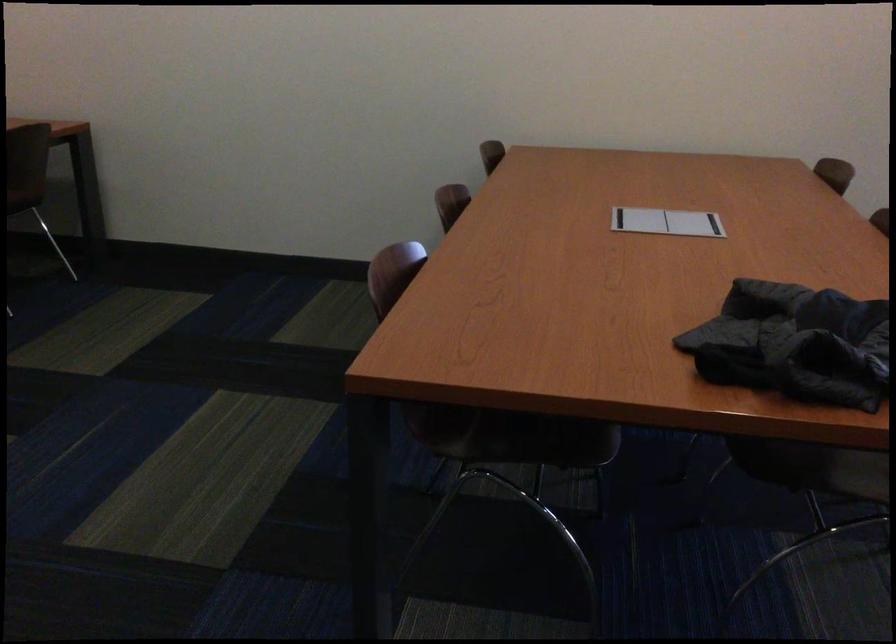
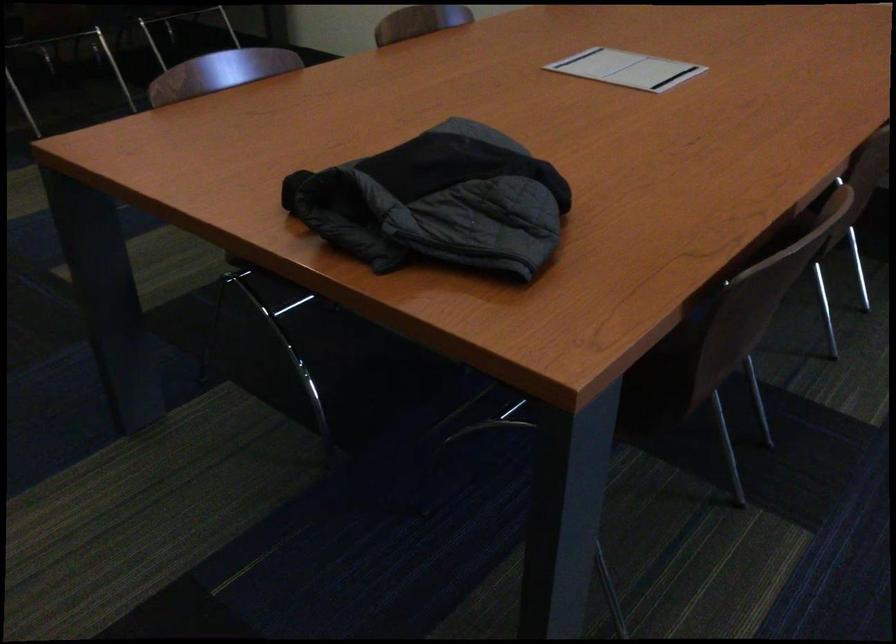
Question: Which direction would the cameraman need to move to produce the second image? Reply with the corresponding letter.

Choices:
 (A) Left
 (B) Right
 (C) Forward
 (D) Backward

Answer: (B)